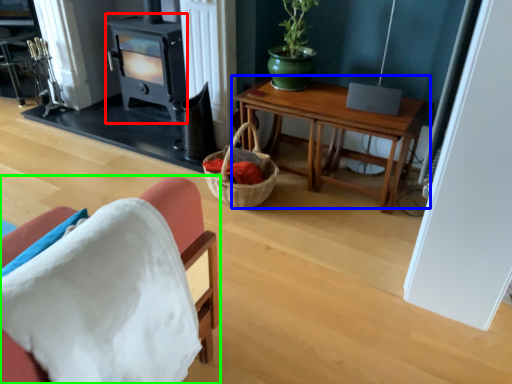
Question: Based on their relative distances, which object is nearer to fireplace (highlighted by a red box)? Choose from table (highlighted by a blue box) and chair (highlighted by a green box).

Choices:
 (A) table
 (B) chair

Answer: (A)